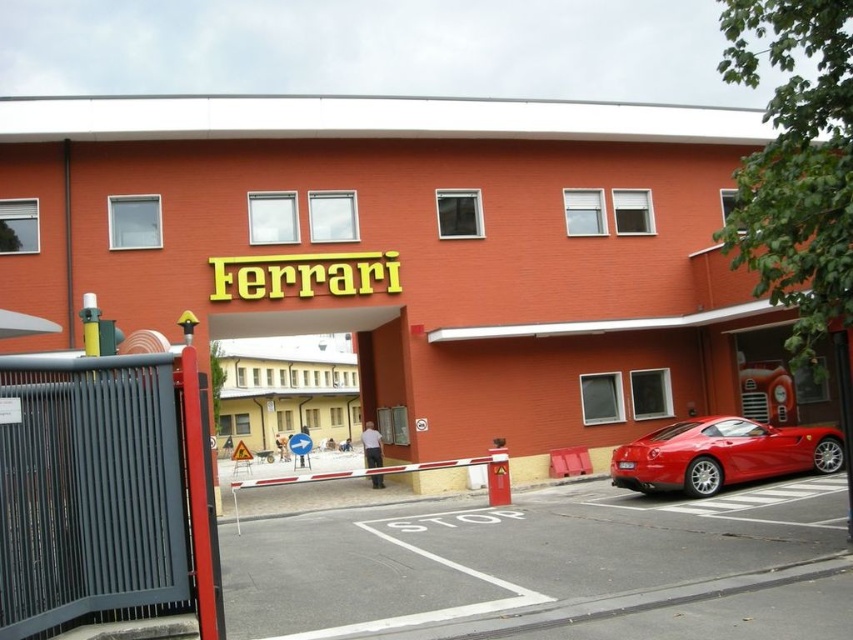
Does glossy red car at right come behind glossy red sports car at lower right?

Yes, glossy red car at right is further from the viewer.

Is point (125, 140) farther from camera compared to point (674, 449)?

That is True.

Find the location of a particular element. The width and height of the screenshot is (853, 640). glossy red car at right is located at coordinates pos(410,250).

What do you see at coordinates (292, 372) in the screenshot? I see `metallic gate at center` at bounding box center [292, 372].

Which of these two, metallic gate at center or glossy red sports car at lower right, stands taller?

Standing taller between the two is metallic gate at center.

Identify the location of metallic gate at center. (292, 372).

Can you confirm if glossy red car at right is bigger than metallic gate at center?

Correct, glossy red car at right is larger in size than metallic gate at center.

Describe the element at coordinates (410, 250) in the screenshot. I see `glossy red car at right` at that location.

Measure the distance between glossy red car at right and camera.

glossy red car at right is 15.74 meters away from camera.

Locate an element on the screen. The height and width of the screenshot is (640, 853). glossy red car at right is located at coordinates (410, 250).